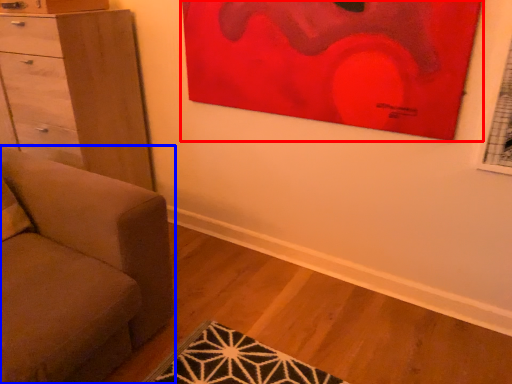
Question: Among these objects, which one is farthest to the camera, picture frame (highlighted by a red box) or studio couch (highlighted by a blue box)?

Choices:
 (A) picture frame
 (B) studio couch

Answer: (A)